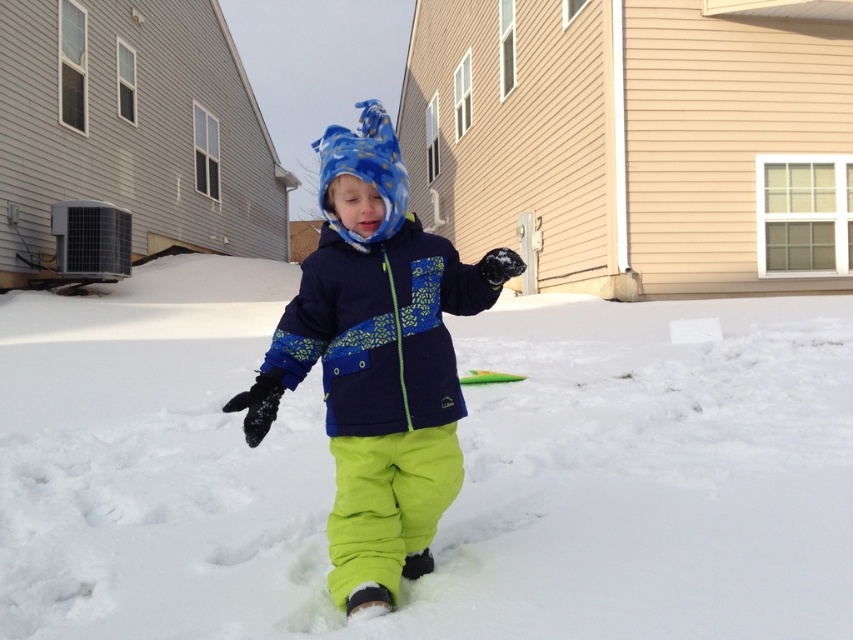
Is white fluffy snow at center below matte blue snowsuit at center?

Correct, white fluffy snow at center is located below matte blue snowsuit at center.

What do you see at coordinates (463, 464) in the screenshot? I see `white fluffy snow at center` at bounding box center [463, 464].

Locate an element on the screen. This screenshot has height=640, width=853. white fluffy snow at center is located at coordinates (463, 464).

What do you see at coordinates (376, 362) in the screenshot?
I see `matte blue snowsuit at center` at bounding box center [376, 362].

Does matte blue snowsuit at center have a larger size compared to navy blue fleece jacket at center?

Yes.

The height and width of the screenshot is (640, 853). In order to click on matte blue snowsuit at center in this screenshot , I will do `click(376, 362)`.

Consider the image. Can you confirm if white fluffy snow at center is taller than navy blue fleece jacket at center?

Correct, white fluffy snow at center is much taller as navy blue fleece jacket at center.

Between white fluffy snow at center and navy blue fleece jacket at center, which one has more height?

white fluffy snow at center

Between point (637, 589) and point (386, 300), which one is positioned behind?

Point (637, 589)

This screenshot has width=853, height=640. In order to click on white fluffy snow at center in this screenshot , I will do `click(463, 464)`.